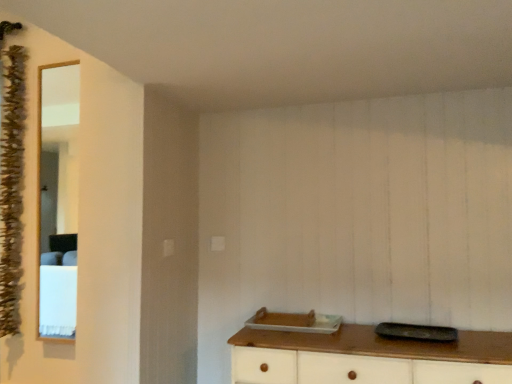
The image size is (512, 384). Describe the element at coordinates (385, 344) in the screenshot. I see `wooden tray at lower center` at that location.

I want to click on wooden tray at lower center, so click(385, 344).

Locate an element on the screen. This screenshot has width=512, height=384. wooden tray at lower center is located at coordinates (385, 344).